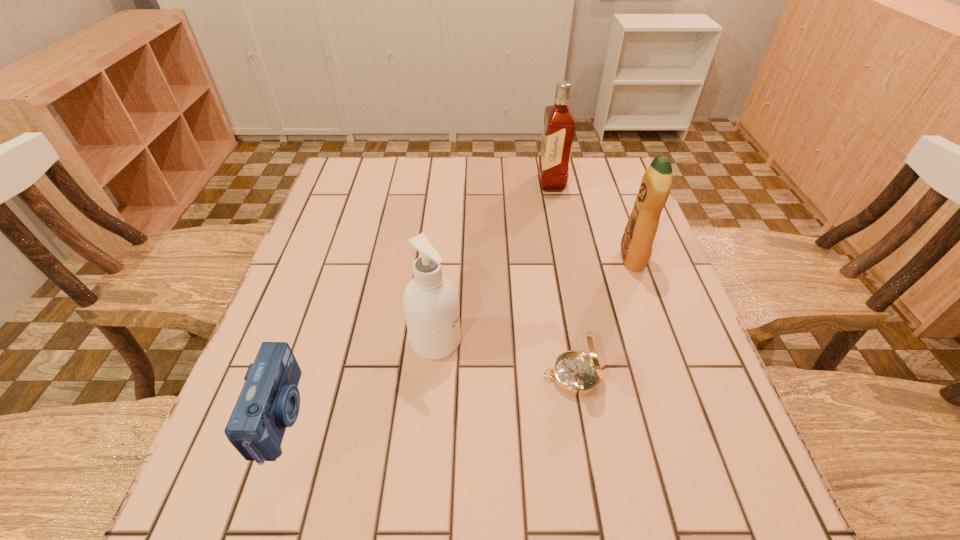
Locate an element on the screen. free spot located on the label of the second farthest object is located at coordinates (464, 258).

I want to click on vacant space located 0.390m on the label of the second farthest object, so click(464, 258).

At what (x,y) coordinates should I click in order to perform the action: click on vacant space located on the front label of the cleansing agent. Please return your answer as a coordinate pair (x, y). This screenshot has width=960, height=540. Looking at the image, I should click on (653, 341).

Locate an element on the screen. blank space located 0.180m with the dial facing the compass is located at coordinates (451, 376).

Find the location of a particular element. vacant area situated 0.290m with the dial facing the compass is located at coordinates (395, 376).

Find the location of a particular element. Image resolution: width=960 pixels, height=540 pixels. free space located 0.150m with the dial facing the compass is located at coordinates (467, 376).

Find the location of a particular element. This screenshot has height=540, width=960. free space located on the lens of the camera is located at coordinates (360, 416).

Identify the location of object positioned at the far edge. This screenshot has width=960, height=540. (559, 125).

Where is `object that is at the left edge`? Image resolution: width=960 pixels, height=540 pixels. object that is at the left edge is located at coordinates (269, 401).

I want to click on object positioned at the right edge, so click(x=636, y=245).